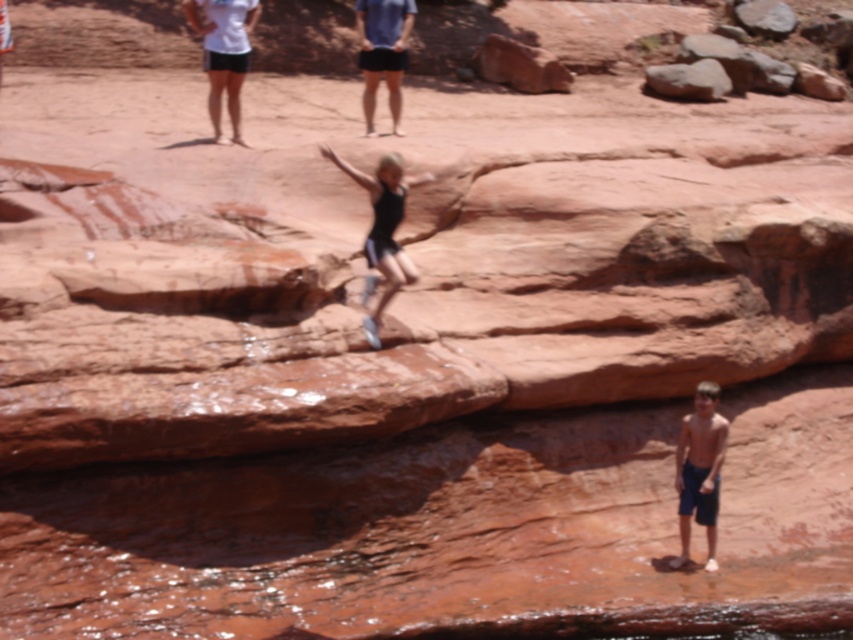
Based on the photo, you are a photographer trying to capture both the shiny blue shorts at lower right and the black matte shorts at center in a single frame. Based on their widths, which one should you focus on to ensure they both fit in the photo?

The shiny blue shorts at lower right has a lesser width compared to black matte shorts at center, so you should focus on the black matte shorts at center to ensure both fit in the photo.